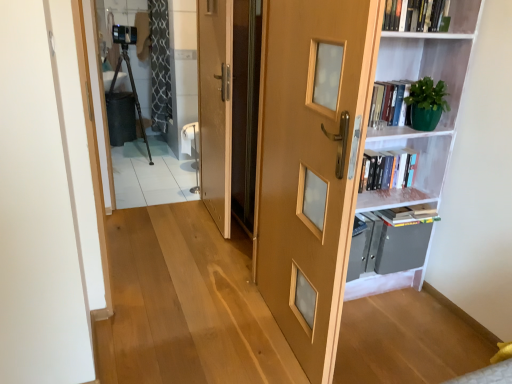
Question: Is hardcover book at upper right, placed as the second book when sorted from front to back, to the left or to the right of wooden door at center, which is the second door from right to left, in the image?

Choices:
 (A) right
 (B) left

Answer: (A)

Question: From a real-world perspective, is hardcover book at upper right, the first book positioned from the bottom, physically located above or below wooden door at center, positioned as the 2th door in front-to-back order?

Choices:
 (A) below
 (B) above

Answer: (A)

Question: Which is farther from the white matte bookshelf at right?

Choices:
 (A) transparent glass screen door at center
 (B) hardcover book at upper right, positioned as the second book in top-to-bottom order
 (C) wooden door at center, positioned as the 2th door in front-to-back order
 (D) clear glass door at upper left
 (E) light brown wooden door at center, positioned as the first door in front-to-back order

Answer: (D)

Question: Considering the real-world distances, which object is closest to the metallic gray cabinet at right?

Choices:
 (A) hardcover book at upper right, which appears as the 2th book when viewed from the back
 (B) hardcover book at upper right, placed as the second book when sorted from front to back
 (C) transparent glass screen door at center
 (D) light brown wooden door at center, which is the 2th door in left-to-right order
 (E) clear glass door at upper left

Answer: (B)